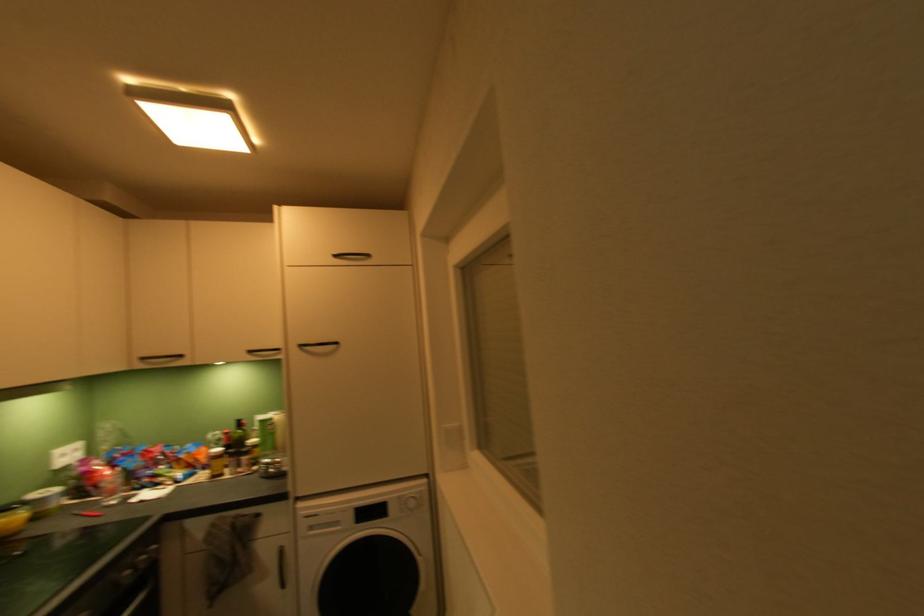
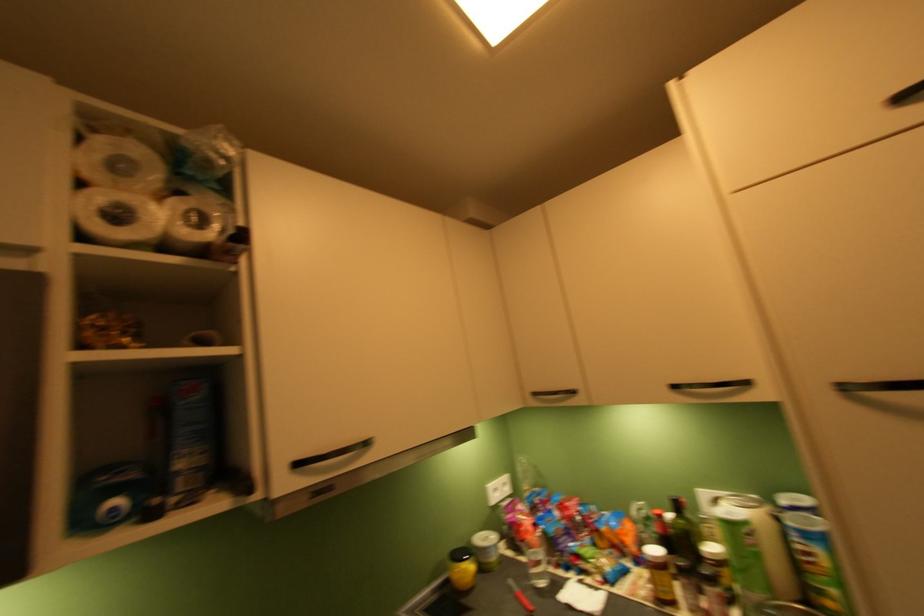
In the second image, find the point that corresponds to pixel 265 434 in the first image.

(715, 524)